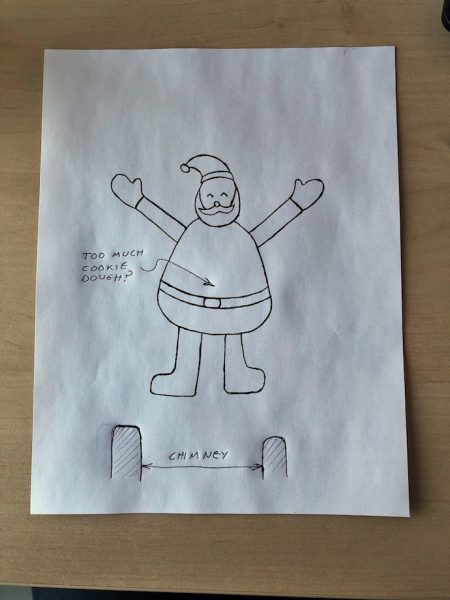
The height and width of the screenshot is (600, 450). What are the coordinates of `floor` in the screenshot? It's located at (24, 593).